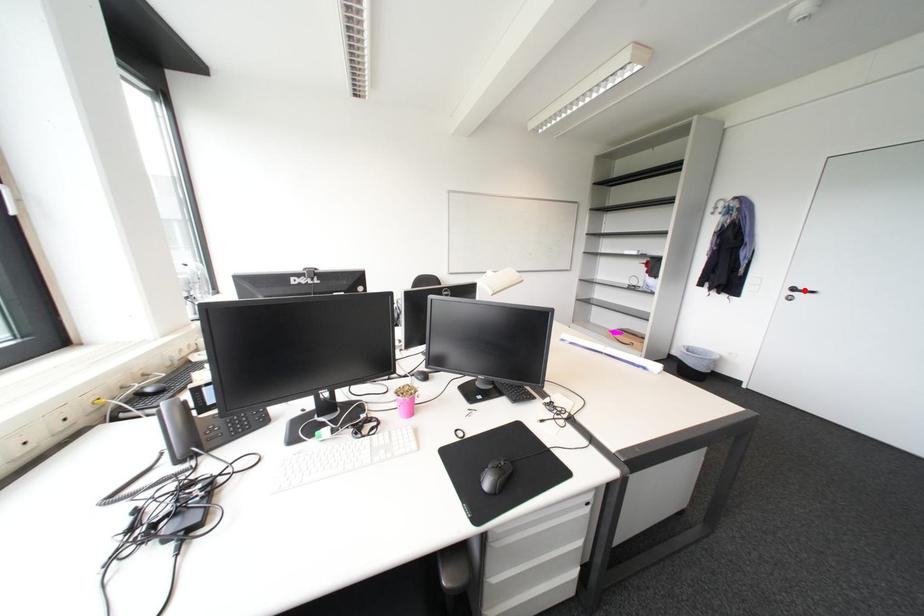
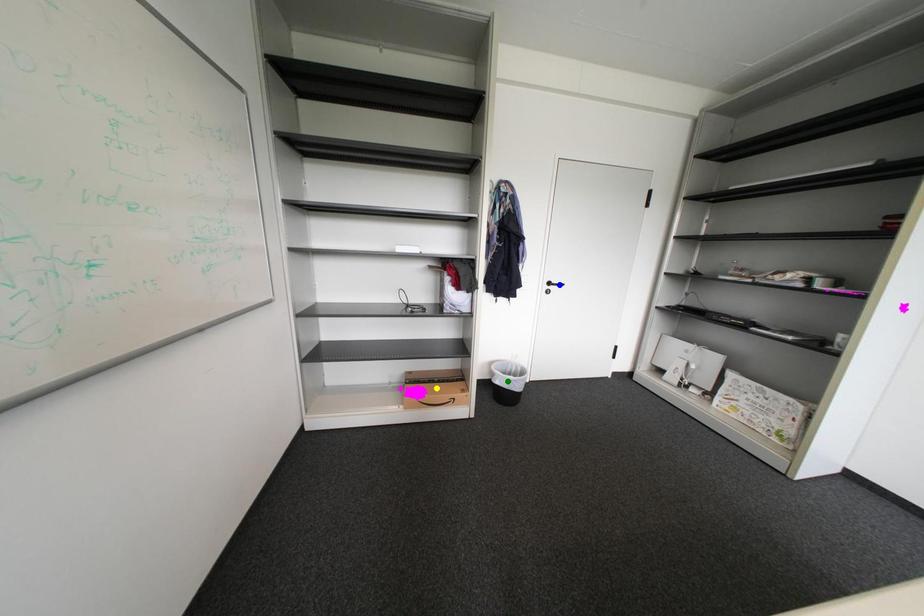
Question: I am providing you with two images of the same scene from different viewpoints. A red point is marked on the first image. You are given multiple points on the second image. Which spot in image 2 lines up with the point in image 1?

Choices:
 (A) green point
 (B) blue point
 (C) yellow point

Answer: (B)